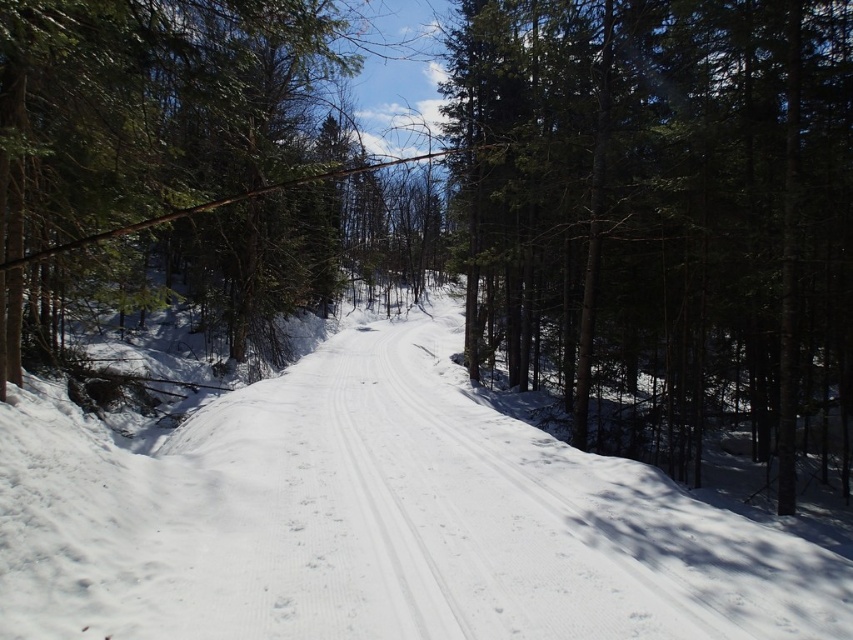
Is white powdery snow at center positioned before green textured tree at center?

Yes.

Is white powdery snow at center bigger than green textured tree at center?

No, white powdery snow at center is not bigger than green textured tree at center.

Which is behind, point (389, 404) or point (709, 65)?

The point (709, 65) is more distant.

Where is `white powdery snow at center`? white powdery snow at center is located at coordinates (379, 520).